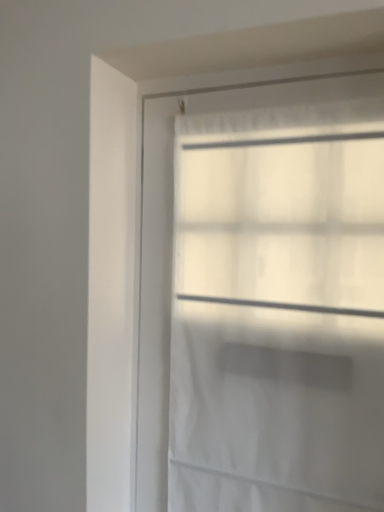
Question: Should I look upward or downward to see white sheer curtain at upper center?

Choices:
 (A) up
 (B) down

Answer: (B)